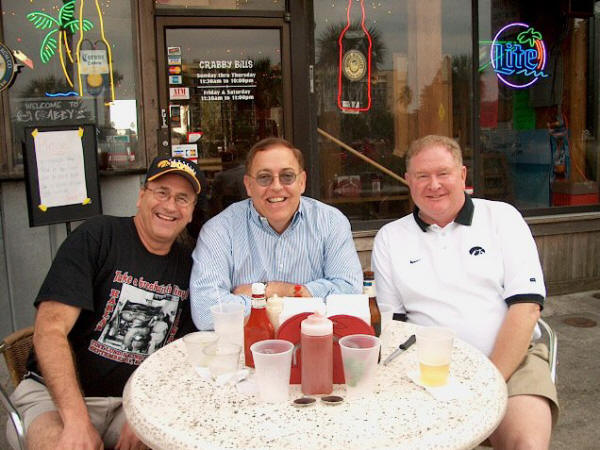
This screenshot has width=600, height=450. I want to click on table, so click(433, 417).